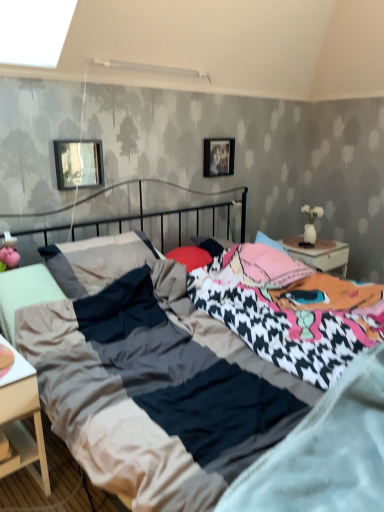
Question: From a real-world perspective, is metallic rectangular frame at upper left, which appears as the 1th picture frame when viewed from the left, beneath soft cotton mattress at center?

Choices:
 (A) no
 (B) yes

Answer: (A)

Question: From the image's perspective, is metallic rectangular frame at upper left, which ranks as the second picture frame in back-to-front order, above soft cotton mattress at center?

Choices:
 (A) no
 (B) yes

Answer: (B)

Question: Is metallic rectangular frame at upper left, which ranks as the second picture frame in back-to-front order, smaller than soft cotton mattress at center?

Choices:
 (A) yes
 (B) no

Answer: (A)

Question: Can you confirm if metallic rectangular frame at upper left, which ranks as the second picture frame in back-to-front order, is taller than soft cotton mattress at center?

Choices:
 (A) yes
 (B) no

Answer: (B)

Question: Is metallic rectangular frame at upper left, which ranks as the second picture frame in back-to-front order, facing towards soft cotton mattress at center?

Choices:
 (A) yes
 (B) no

Answer: (A)

Question: From a real-world perspective, is textured cotton bed at center above or below white matte nightstand at lower left?

Choices:
 (A) above
 (B) below

Answer: (A)

Question: Would you say textured cotton bed at center is to the left or to the right of white matte nightstand at lower left in the picture?

Choices:
 (A) left
 (B) right

Answer: (B)

Question: From the image's perspective, is textured cotton bed at center located above or below white matte nightstand at lower left?

Choices:
 (A) below
 (B) above

Answer: (B)

Question: Considering their positions, is textured cotton bed at center located in front of or behind white matte nightstand at lower left?

Choices:
 (A) front
 (B) behind

Answer: (A)

Question: Is point (215, 342) closer or farther from the camera than point (226, 148)?

Choices:
 (A) farther
 (B) closer

Answer: (B)

Question: Choose the correct answer: Is textured cotton bed at center inside metallic silver picture frame at upper center, marked as the 1th picture frame in a back-to-front arrangement, or outside it?

Choices:
 (A) outside
 (B) inside

Answer: (A)

Question: Is textured cotton bed at center bigger or smaller than metallic silver picture frame at upper center, which is the second picture frame from front to back?

Choices:
 (A) big
 (B) small

Answer: (A)

Question: Considering the positions of textured cotton bed at center and metallic silver picture frame at upper center, which is the second picture frame from front to back, in the image, is textured cotton bed at center wider or thinner than metallic silver picture frame at upper center, which is the second picture frame from front to back,?

Choices:
 (A) wide
 (B) thin

Answer: (A)

Question: Relative to metallic rectangular frame at upper left, which ranks as the second picture frame in back-to-front order, is metallic silver picture frame at upper center, the 2th picture frame from the left, in front or behind?

Choices:
 (A) front
 (B) behind

Answer: (B)

Question: From a real-world perspective, relative to metallic rectangular frame at upper left, which appears as the 1th picture frame when viewed from the left, is metallic silver picture frame at upper center, the 2th picture frame from the left, vertically above or below?

Choices:
 (A) below
 (B) above

Answer: (B)